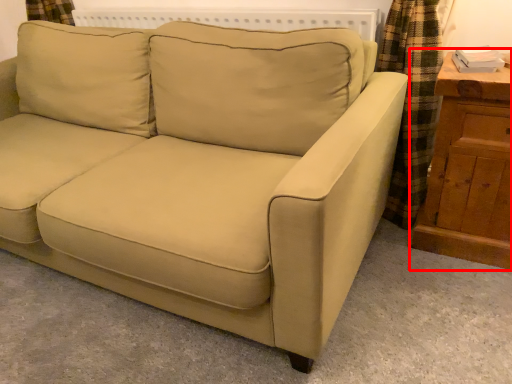
Question: From the image's perspective, what is the correct spatial positioning of dresser (annotated by the red box) in reference to studio couch?

Choices:
 (A) below
 (B) above

Answer: (A)